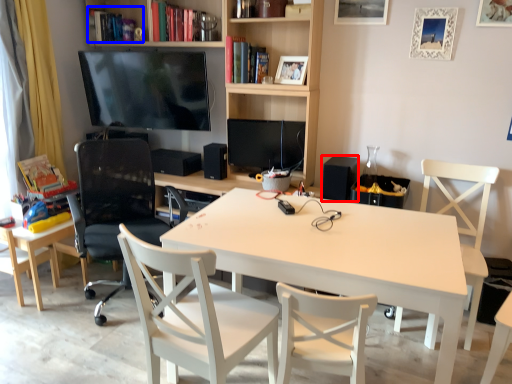
Question: Which point is further to the camera, speaker (highlighted by a red box) or book (highlighted by a blue box)?

Choices:
 (A) speaker
 (B) book

Answer: (B)